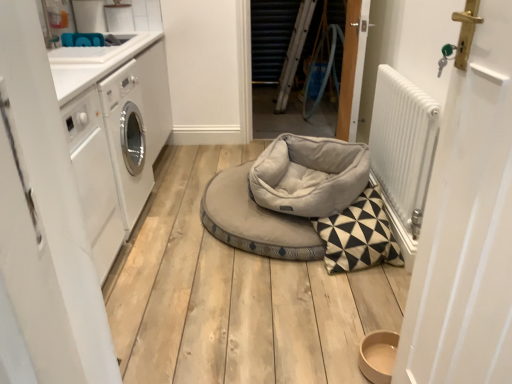
Question: Could white glossy countertop at upper left be considered to be inside white matte door at left, arranged as the 2th door when viewed from the front?

Choices:
 (A) no
 (B) yes

Answer: (A)

Question: Is white matte door at left, acting as the 3th door starting from the back, positioned in front of white glossy countertop at upper left?

Choices:
 (A) yes
 (B) no

Answer: (A)

Question: Is white matte door at left, acting as the 3th door starting from the back, further to the viewer compared to white glossy countertop at upper left?

Choices:
 (A) yes
 (B) no

Answer: (B)

Question: Does white matte door at left, which ranks as the fourth door in right-to-left order, have a greater height compared to white glossy countertop at upper left?

Choices:
 (A) no
 (B) yes

Answer: (B)

Question: From a real-world perspective, is white matte door at left, which ranks as the fourth door in right-to-left order, below white glossy countertop at upper left?

Choices:
 (A) no
 (B) yes

Answer: (B)

Question: From the image's perspective, relative to white glossy countertop at upper left, is white glossy washing machine at left above or below?

Choices:
 (A) below
 (B) above

Answer: (A)

Question: In the image, is white glossy washing machine at left positioned in front of or behind white glossy countertop at upper left?

Choices:
 (A) front
 (B) behind

Answer: (B)

Question: Is point click(x=91, y=127) closer or farther from the camera than point click(x=74, y=91)?

Choices:
 (A) closer
 (B) farther

Answer: (B)

Question: In terms of height, does white glossy washing machine at left look taller or shorter compared to white glossy countertop at upper left?

Choices:
 (A) tall
 (B) short

Answer: (A)

Question: From a real-world perspective, relative to white matte door at left, acting as the 3th door starting from the back, is wooden door at center, marked as the 4th door in a front-to-back arrangement, vertically above or below?

Choices:
 (A) above
 (B) below

Answer: (A)

Question: Is point (284, 3) positioned closer to the camera than point (47, 200)?

Choices:
 (A) farther
 (B) closer

Answer: (A)

Question: Would you say wooden door at center, arranged as the 2th door when viewed from the left, is to the left or to the right of white matte door at left, which ranks as the fourth door in right-to-left order, in the picture?

Choices:
 (A) right
 (B) left

Answer: (A)

Question: Looking at their shapes, would you say wooden door at center, arranged as the 2th door when viewed from the left, is wider or thinner than white matte door at left, arranged as the 2th door when viewed from the front?

Choices:
 (A) thin
 (B) wide

Answer: (A)

Question: Choose the correct answer: Is wooden door at center, which is the third door in front-to-back order, inside white matte door at left, acting as the first door starting from the left, or outside it?

Choices:
 (A) outside
 (B) inside

Answer: (A)

Question: Looking at the image, does wooden door at center, which is the third door in front-to-back order, seem bigger or smaller compared to white matte door at left, arranged as the 2th door when viewed from the front?

Choices:
 (A) big
 (B) small

Answer: (B)